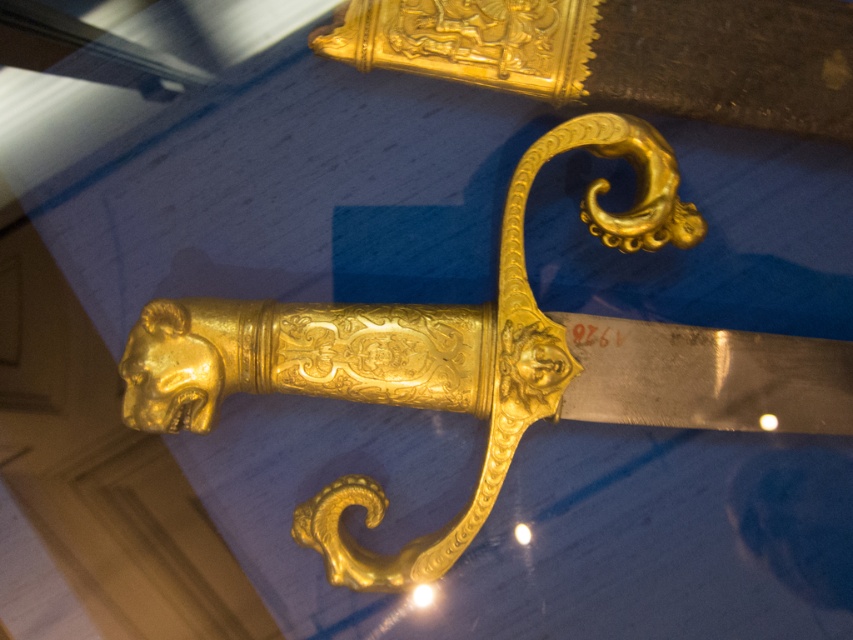
Question: Does gold polished sword at center appear on the right side of gold polished sword at upper center?

Choices:
 (A) yes
 (B) no

Answer: (B)

Question: Can you confirm if gold polished sword at center is positioned above gold polished sword at upper center?

Choices:
 (A) no
 (B) yes

Answer: (A)

Question: Which of the following is the farthest from the observer?

Choices:
 (A) (369, 355)
 (B) (537, 74)

Answer: (B)

Question: Is gold polished sword at center smaller than gold polished sword at upper center?

Choices:
 (A) no
 (B) yes

Answer: (A)

Question: Which of the following is the farthest from the observer?

Choices:
 (A) gold polished sword at center
 (B) gold polished sword at upper center

Answer: (B)

Question: Which object appears closest to the camera in this image?

Choices:
 (A) gold polished sword at center
 (B) gold polished sword at upper center

Answer: (A)